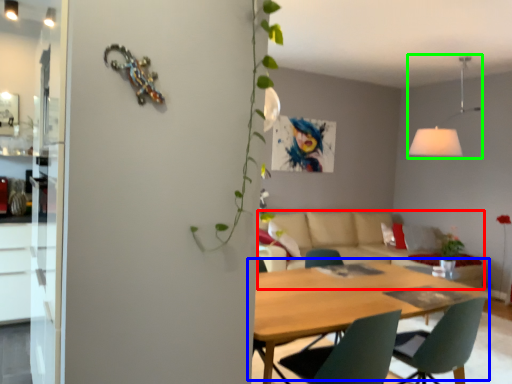
Question: Considering the real-world distances, which object is closest to couch (highlighted by a red box)? kitchen & dining room table (highlighted by a blue box) or light fixture (highlighted by a green box).

Choices:
 (A) kitchen & dining room table
 (B) light fixture

Answer: (B)